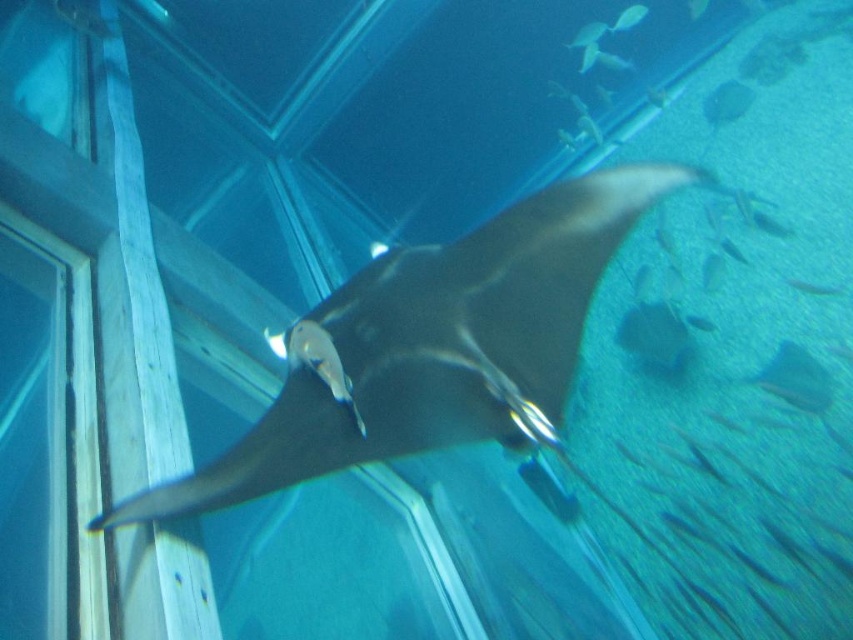
Question: Which of the following is the farthest from the observer?

Choices:
 (A) (635, 196)
 (B) (793, 282)

Answer: (B)

Question: Is translucent white fish at upper center thinner than translucent white fish at center?

Choices:
 (A) no
 (B) yes

Answer: (A)

Question: Which point is closer to the camera?

Choices:
 (A) (641, 17)
 (B) (830, 291)
 (C) (593, 36)

Answer: (B)

Question: Based on their relative distances, which object is farther from the translucent blue fish at upper center?

Choices:
 (A) shiny black stingray at center
 (B) translucent white fish at upper center

Answer: (A)

Question: Does shiny black stingray at center have a greater width compared to translucent white fish at center?

Choices:
 (A) yes
 (B) no

Answer: (A)

Question: Is translucent white fish at upper center below translucent blue fish at upper center?

Choices:
 (A) no
 (B) yes

Answer: (B)